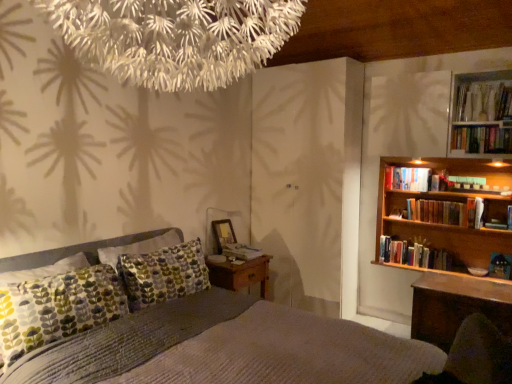
The image size is (512, 384). I want to click on empty space that is ontop of hardcover books at right, positioned as the 4th book in top-to-bottom order (from a real-world perspective), so click(437, 200).